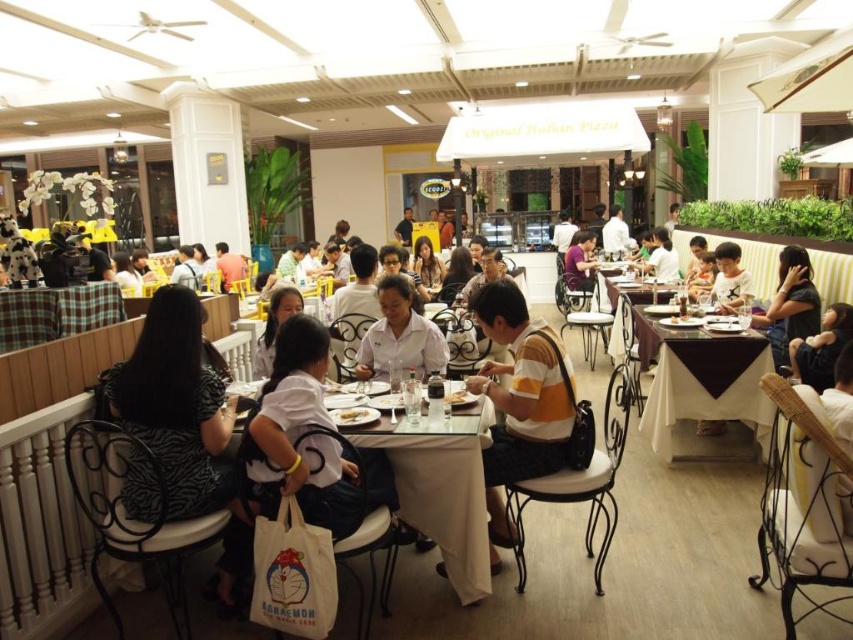
You are a food delivery person standing at the entrance of the dining area. You need to deliver a meal to the person wearing the purple fabric shirt at center. However, there is a white porcelain plate at center in your path. Can you reach the person without moving the plate?

The purple fabric shirt at center is 6.93 meters away from the white porcelain plate at center. Since the distance between them is over 6 meters, you can easily reach the person without needing to move the plate as there is sufficient space between them.

You are a photographer standing in the dining area and want to take a photo of the white marble table at center and the white matte shirt at center. Which object should you focus on first to ensure it appears sharp in the foreground?

You should focus on the white marble table at center first because it is closer to you than the white matte shirt at center, making it the foreground object.